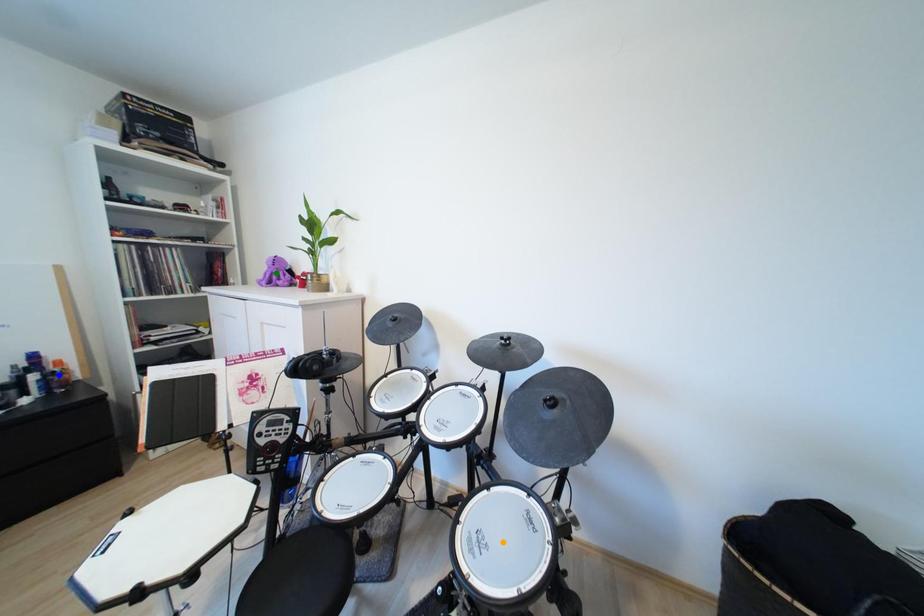
Order these from farthest to nearest:
A) orange point
B) green point
C) blue point

green point, blue point, orange point